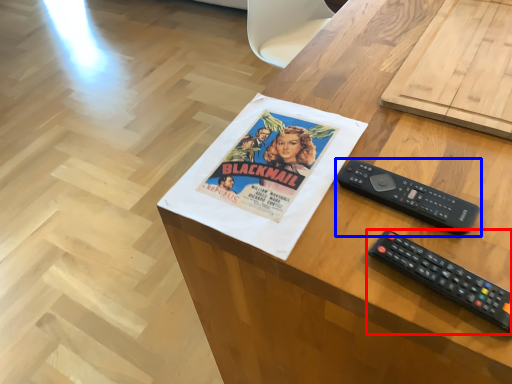
Question: Among these objects, which one is farthest to the camera, remote control (highlighted by a red box) or remote control (highlighted by a blue box)?

Choices:
 (A) remote control
 (B) remote control

Answer: (B)